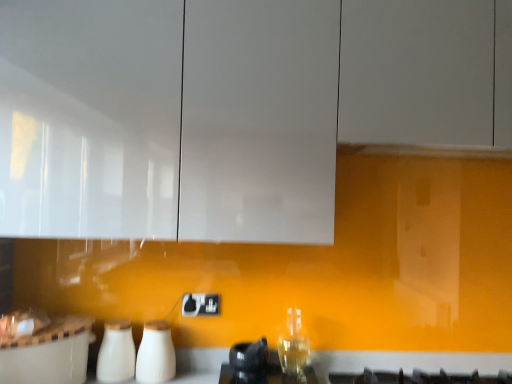
Question: Does white glossy milk bottles at lower center, which is counted as the second appliance, starting from the right, have a smaller size compared to white glossy cabinet at upper center?

Choices:
 (A) yes
 (B) no

Answer: (A)

Question: Would you consider white glossy milk bottles at lower center, the 1th appliance positioned from the left, to be distant from white glossy cabinet at upper center?

Choices:
 (A) yes
 (B) no

Answer: (B)

Question: Is white glossy milk bottles at lower center, the 1th appliance positioned from the left, facing towards white glossy cabinet at upper center?

Choices:
 (A) yes
 (B) no

Answer: (B)

Question: Is white glossy milk bottles at lower center, which is counted as the second appliance, starting from the right, completely or partially outside of white glossy cabinet at upper center?

Choices:
 (A) no
 (B) yes

Answer: (B)

Question: Can you confirm if white glossy milk bottles at lower center, the 1th appliance positioned from the left, is thinner than white glossy cabinet at upper center?

Choices:
 (A) no
 (B) yes

Answer: (B)

Question: Is white glossy cabinet at upper center wider or thinner than black plastic electric outlet at center?

Choices:
 (A) thin
 (B) wide

Answer: (B)

Question: Is white glossy cabinet at upper center in front of or behind black plastic electric outlet at center in the image?

Choices:
 (A) front
 (B) behind

Answer: (A)

Question: In terms of height, does white glossy cabinet at upper center look taller or shorter compared to black plastic electric outlet at center?

Choices:
 (A) short
 (B) tall

Answer: (B)

Question: In the image, is white glossy cabinet at upper center on the left side or the right side of black plastic electric outlet at center?

Choices:
 (A) left
 (B) right

Answer: (B)

Question: In terms of size, does black plastic electric outlet at center appear bigger or smaller than white glossy milk bottles at lower center, the 1th appliance positioned from the left?

Choices:
 (A) small
 (B) big

Answer: (A)

Question: Does point (181, 309) appear closer or farther from the camera than point (102, 380)?

Choices:
 (A) farther
 (B) closer

Answer: (A)

Question: In terms of width, does black plastic electric outlet at center look wider or thinner when compared to white glossy milk bottles at lower center, which is counted as the second appliance, starting from the right?

Choices:
 (A) thin
 (B) wide

Answer: (A)

Question: Which is correct: black plastic electric outlet at center is inside white glossy milk bottles at lower center, the 1th appliance positioned from the left, or outside of it?

Choices:
 (A) outside
 (B) inside

Answer: (A)

Question: In terms of size, does white glossy countertop at lower center appear bigger or smaller than black plastic electric outlet at center?

Choices:
 (A) big
 (B) small

Answer: (A)

Question: Would you say white glossy countertop at lower center is to the left or to the right of black plastic electric outlet at center in the picture?

Choices:
 (A) left
 (B) right

Answer: (B)